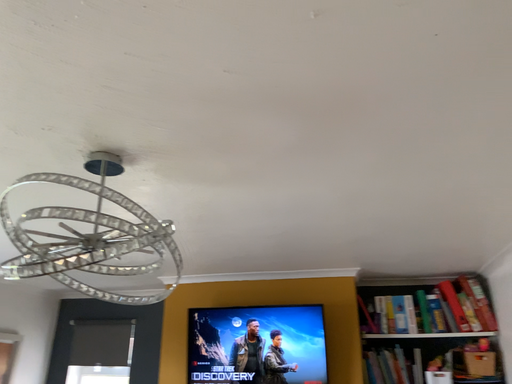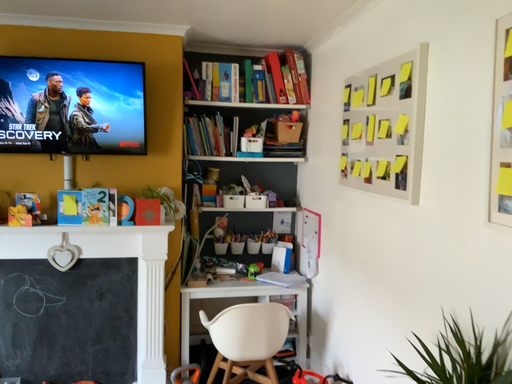
Question: How did the camera likely rotate when shooting the video?

Choices:
 (A) rotated downward
 (B) rotated upward

Answer: (A)